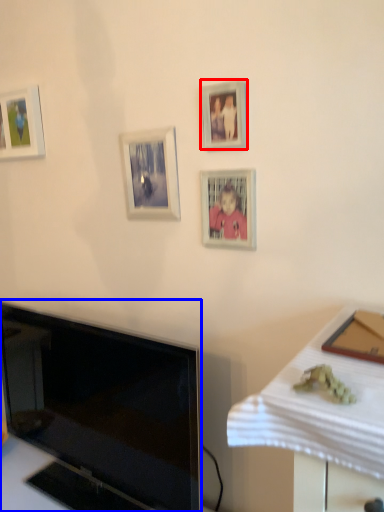
Question: Which object appears farthest to the camera in this image, picture frame (highlighted by a red box) or television (highlighted by a blue box)?

Choices:
 (A) picture frame
 (B) television

Answer: (A)